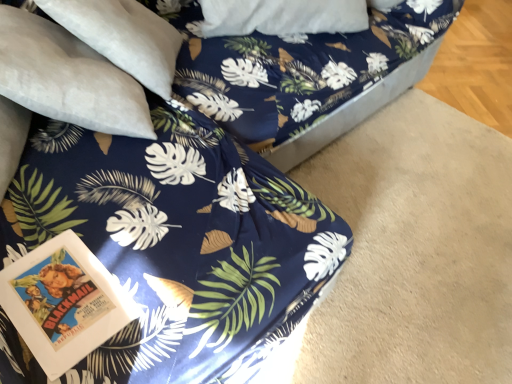
Question: Does suede-like beige pillow at upper left have a greater width compared to blue fabric bed frame at center?

Choices:
 (A) yes
 (B) no

Answer: (B)

Question: Is blue fabric bed frame at center surrounded by suede-like beige pillow at upper left?

Choices:
 (A) no
 (B) yes

Answer: (A)

Question: Considering the relative positions of suede-like beige pillow at upper left and blue fabric bed frame at center in the image provided, is suede-like beige pillow at upper left to the left of blue fabric bed frame at center from the viewer's perspective?

Choices:
 (A) no
 (B) yes

Answer: (B)

Question: Is suede-like beige pillow at upper left smaller than blue fabric bed frame at center?

Choices:
 (A) yes
 (B) no

Answer: (A)

Question: Can we say suede-like beige pillow at upper left lies outside blue fabric bed frame at center?

Choices:
 (A) no
 (B) yes

Answer: (A)

Question: Considering the relative sizes of suede-like beige pillow at upper left and blue fabric bed frame at center in the image provided, is suede-like beige pillow at upper left bigger than blue fabric bed frame at center?

Choices:
 (A) yes
 (B) no

Answer: (B)

Question: From the image's perspective, is blue fabric bed frame at center located above suede-like beige pillow at upper left?

Choices:
 (A) no
 (B) yes

Answer: (B)

Question: Considering the relative sizes of blue fabric bed frame at center and suede-like beige pillow at upper left in the image provided, is blue fabric bed frame at center taller than suede-like beige pillow at upper left?

Choices:
 (A) no
 (B) yes

Answer: (B)

Question: Does blue fabric bed frame at center touch suede-like beige pillow at upper left?

Choices:
 (A) yes
 (B) no

Answer: (B)

Question: Would you say blue fabric bed frame at center is outside suede-like beige pillow at upper left?

Choices:
 (A) yes
 (B) no

Answer: (A)

Question: Is blue fabric bed frame at center looking in the opposite direction of suede-like beige pillow at upper left?

Choices:
 (A) yes
 (B) no

Answer: (B)

Question: Does blue fabric bed frame at center come behind suede-like beige pillow at upper left?

Choices:
 (A) no
 (B) yes

Answer: (B)

Question: Relative to suede-like beige pillow at upper left, is blue fabric bed frame at center in front or behind?

Choices:
 (A) behind
 (B) front

Answer: (A)